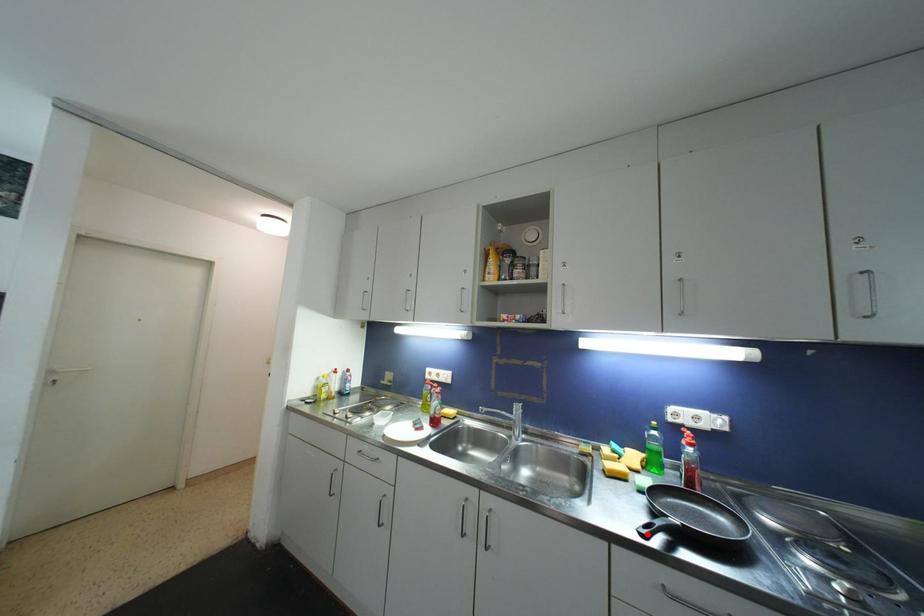
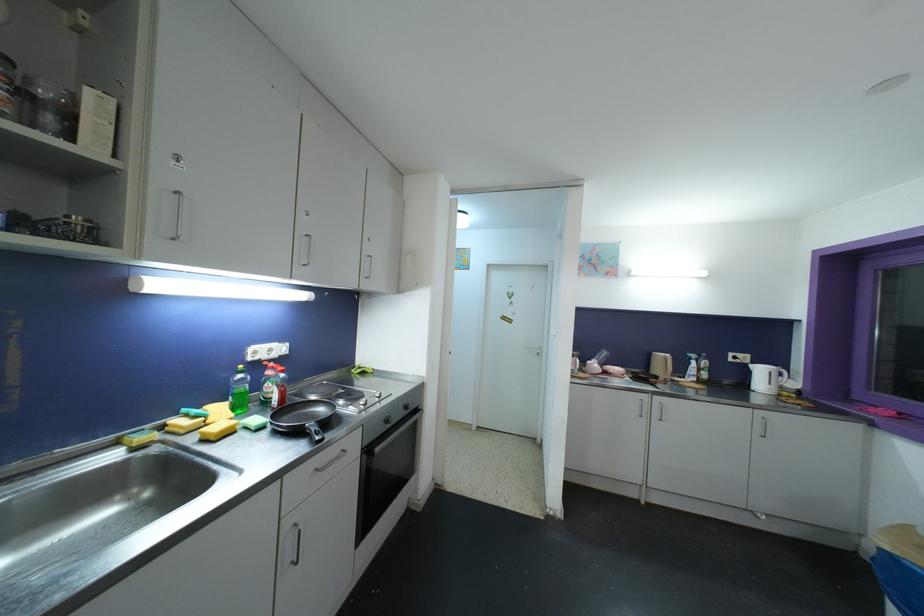
Question: I am providing you with two images of the same scene from different viewpoints. In image1, a red point is highlighted. Considering the same 3D point in image2, which of the following is correct?

Choices:
 (A) It is closer
 (B) It is farther

Answer: (A)